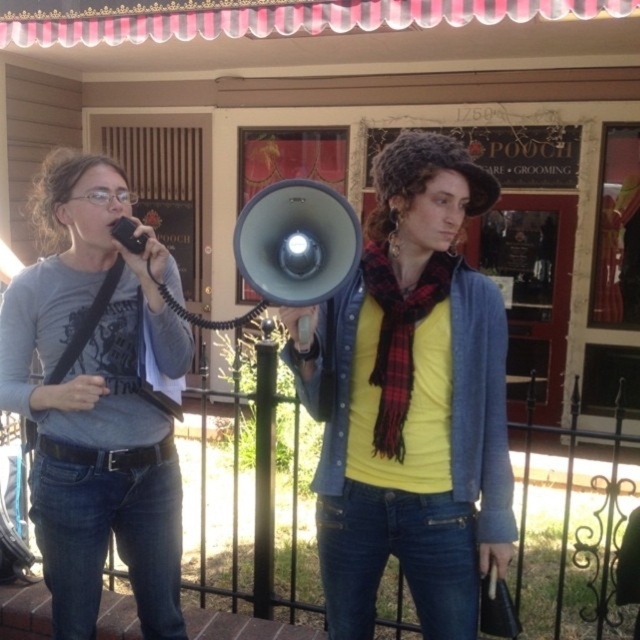
Based on the photo, you are a photographer trying to capture both the matte gray shirt at left and the matte gray megaphone at center in a single frame. Given their sizes, which object should you focus on to ensure both are clearly visible in the photo?

Since the matte gray shirt at left is bigger than the matte gray megaphone at center, you should focus on the matte gray shirt at left to ensure both objects are clearly visible in the photo.

You are a sound technician at the event. You need to adjust the microphone sensitivity to ensure that both the person speaking into the small handheld microphone and the person with the megaphone can be heard clearly. Based on their positions, which object is closer to you, the matte black megaphone at center or the matte gray shirt at left?

The matte black megaphone at center is closer to you because it is in front of the matte gray shirt at left.